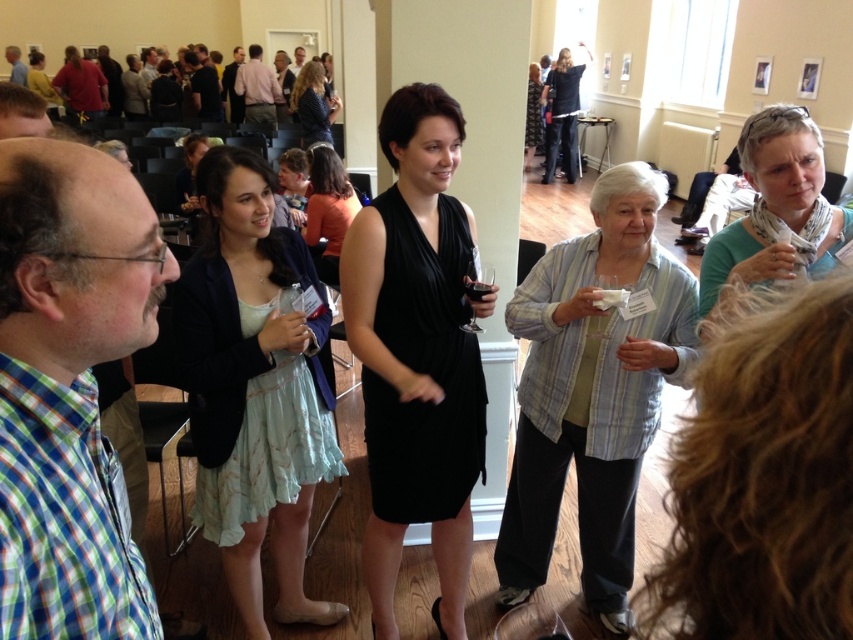
Question: Does green plaid shirt at left lie behind white scarf at upper right?

Choices:
 (A) no
 (B) yes

Answer: (A)

Question: Is black satin dress at center above light blue fabric dress at center?

Choices:
 (A) no
 (B) yes

Answer: (B)

Question: Which point is closer to the camera?

Choices:
 (A) dark gray shirt at upper left
 (B) translucent glass at center

Answer: (B)

Question: Which of these objects is positioned closest to the white scarf at upper right?

Choices:
 (A) dark gray shirt at upper left
 (B) black dress at center

Answer: (B)

Question: Which object is farther from the camera taking this photo?

Choices:
 (A) dark gray shirt at upper left
 (B) matte black dress at center
 (C) orange fabric dress at center

Answer: (A)

Question: Is white scarf at upper right to the left of blonde hair at upper center from the viewer's perspective?

Choices:
 (A) no
 (B) yes

Answer: (A)